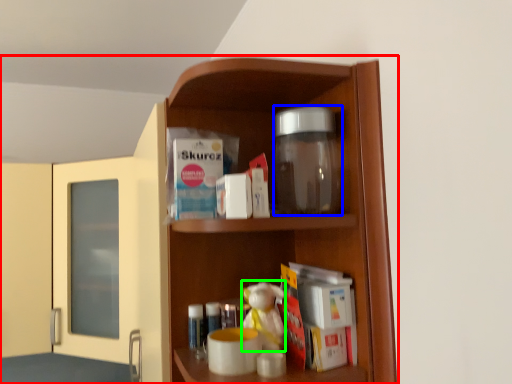
Question: Considering the real-world distances, which object is closest to cupboard (highlighted by a red box)? glass jar (highlighted by a blue box) or toy (highlighted by a green box).

Choices:
 (A) glass jar
 (B) toy

Answer: (A)